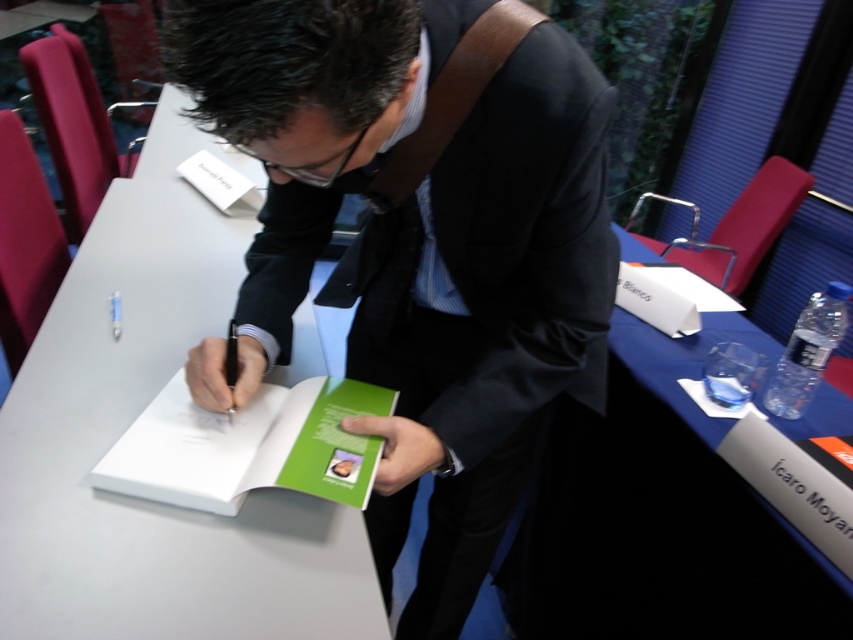
Question: Which of these objects is positioned farthest from the matte black suit at center?

Choices:
 (A) green matte book at center
 (B) black paper at lower right

Answer: (B)

Question: Is matte black suit at center to the left of green matte book at center from the viewer's perspective?

Choices:
 (A) yes
 (B) no

Answer: (B)

Question: Can you confirm if matte black suit at center is positioned below green matte book at center?

Choices:
 (A) no
 (B) yes

Answer: (A)

Question: Based on their relative distances, which object is farther from the matte black suit at center?

Choices:
 (A) black paper at lower right
 (B) green matte book at center

Answer: (A)

Question: Does green matte book at center appear under black paper at lower right?

Choices:
 (A) no
 (B) yes

Answer: (A)

Question: Among these objects, which one is nearest to the camera?

Choices:
 (A) green matte book at center
 (B) black paper at lower right

Answer: (A)